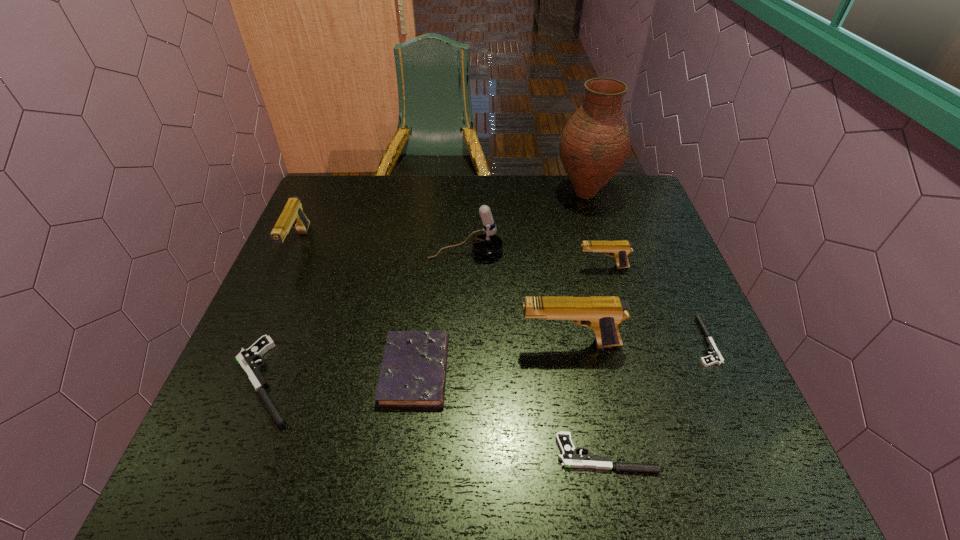
Locate an element on the screen. The height and width of the screenshot is (540, 960). vacant position at the far left corner of the desktop is located at coordinates (345, 209).

What are the coordinates of `free spot between the fourth shortest pistol and the leftmost black pistol` in the screenshot? It's located at (434, 324).

Find the location of `free space between the smallest black pistol and the second tallest pistol`. free space between the smallest black pistol and the second tallest pistol is located at coordinates (500, 293).

I want to click on vacant space in between the farthest object and the rightmost pistol, so click(x=644, y=267).

Where is `vacant space that is in between the second smallest tan pistol and the diary`? The width and height of the screenshot is (960, 540). vacant space that is in between the second smallest tan pistol and the diary is located at coordinates pos(357,308).

Identify the location of free point between the diary and the eighth tallest object. (511, 412).

This screenshot has width=960, height=540. I want to click on vacant area between the microphone and the smallest tan pistol, so click(534, 260).

I want to click on vacant area that lies between the vase and the fourth shortest pistol, so click(x=594, y=230).

Find the location of `free spot between the rightmost object and the fourth tallest object`. free spot between the rightmost object and the fourth tallest object is located at coordinates (500, 293).

You are a GUI agent. You are given a task and a screenshot of the screen. Output one action in this format:
    pyautogui.click(x=<x>, y=<y>)
    Task: Click on the vacant space that's between the fourth shortest object and the nearest tan pistol
    Image resolution: width=960 pixels, height=540 pixels.
    Given the screenshot: What is the action you would take?
    pyautogui.click(x=492, y=357)